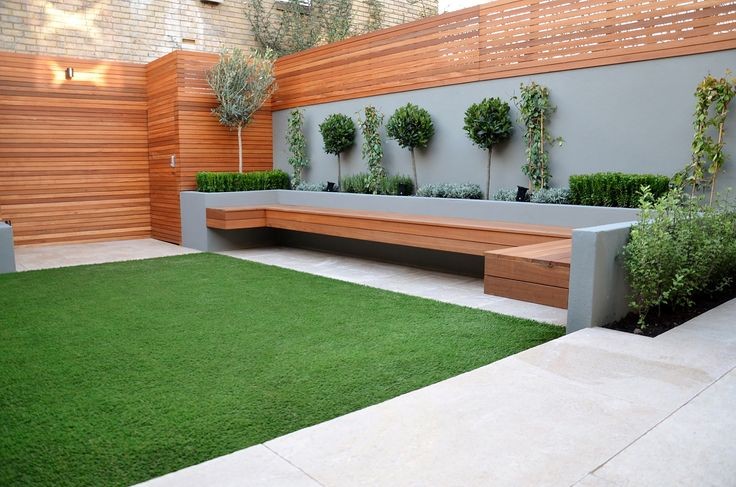
Locate an element on the screen. wall sconce is located at coordinates (70, 77).